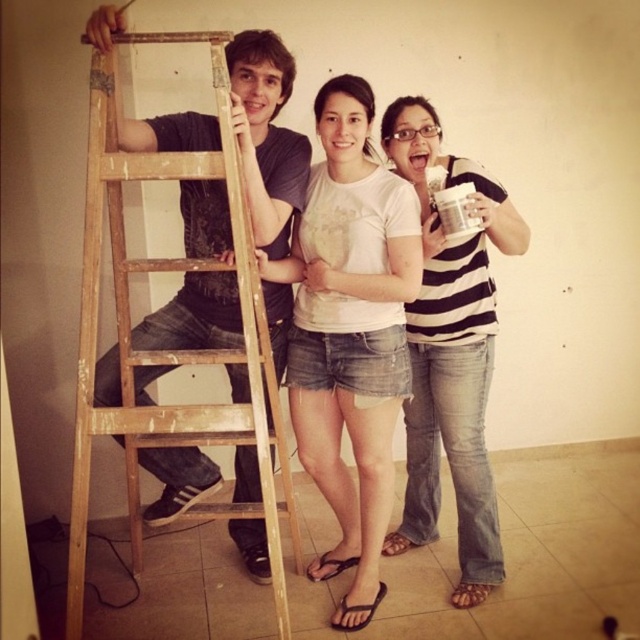
Question: Which object appears farthest from the camera in this image?

Choices:
 (A) wooden ladder at left
 (B) striped cotton shirt at center
 (C) white matte t-shirt at center

Answer: (B)

Question: Is white matte t-shirt at center bigger than striped cotton shirt at center?

Choices:
 (A) yes
 (B) no

Answer: (A)

Question: Does white matte t-shirt at center appear under wooden ladder at left?

Choices:
 (A) yes
 (B) no

Answer: (B)

Question: Is white matte t-shirt at center above striped cotton shirt at center?

Choices:
 (A) no
 (B) yes

Answer: (A)

Question: Based on their relative distances, which object is farther from the white matte t-shirt at center?

Choices:
 (A) striped cotton shirt at center
 (B) wooden ladder at left

Answer: (B)

Question: Which object is closer to the camera taking this photo?

Choices:
 (A) wooden ladder at left
 (B) striped cotton shirt at center
 (C) white matte t-shirt at center

Answer: (A)